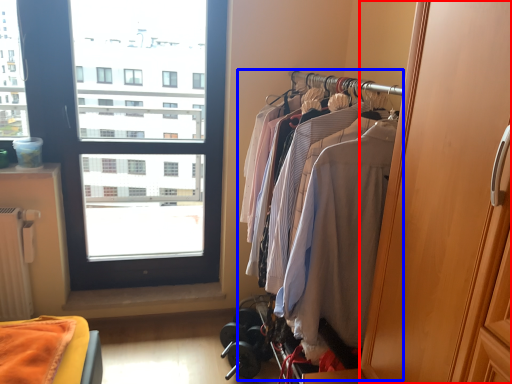
Question: Which object appears farthest to the camera in this image, screen door (highlighted by a red box) or closet (highlighted by a blue box)?

Choices:
 (A) screen door
 (B) closet

Answer: (B)